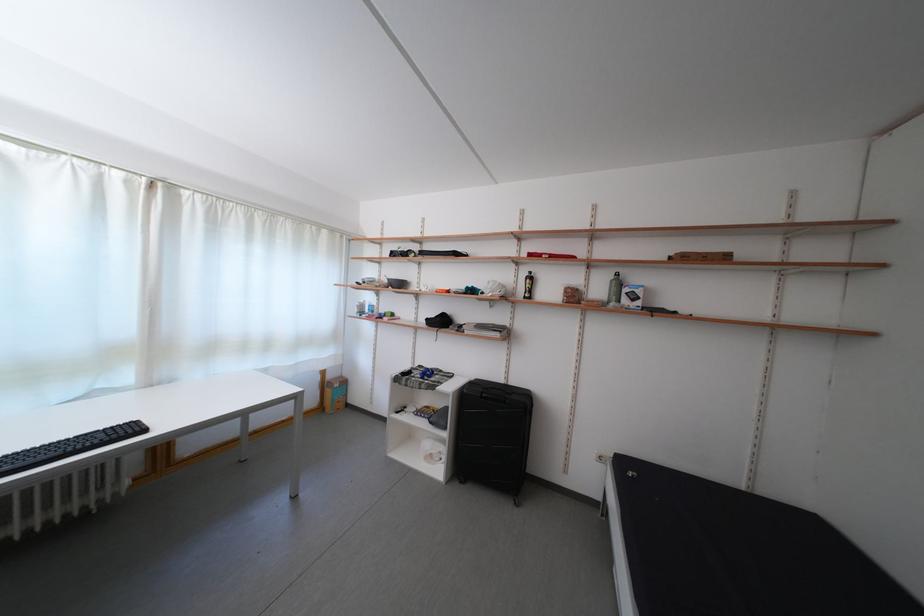
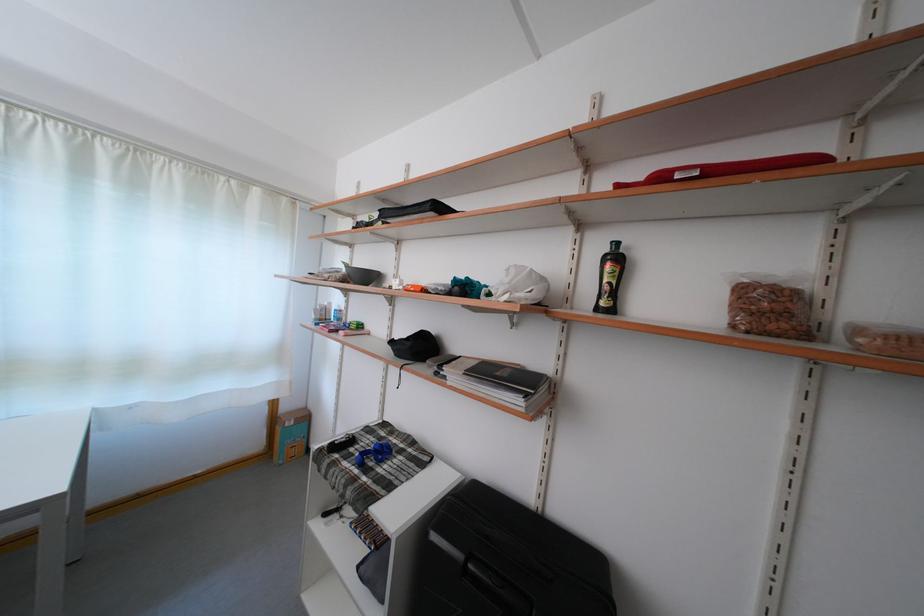
In the second image, find the point that corresponds to point 506,341 in the first image.

(527, 408)